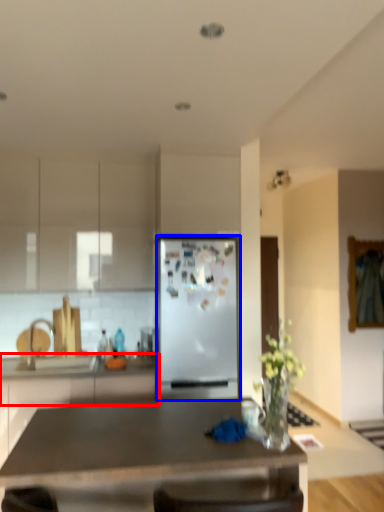
Question: Among these objects, which one is nearest to the camera, counter top (highlighted by a red box) or refrigerator (highlighted by a blue box)?

Choices:
 (A) counter top
 (B) refrigerator

Answer: (A)